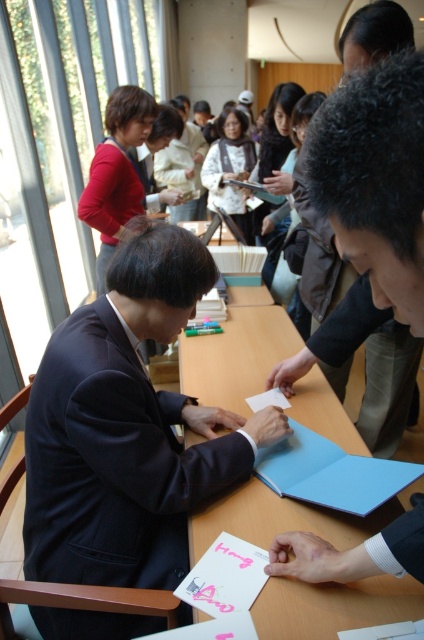
Question: Is matte black folder at center smaller than white paper at center?

Choices:
 (A) no
 (B) yes

Answer: (A)

Question: Which point is farther to the camera?

Choices:
 (A) (415, 596)
 (B) (41, 524)
 (C) (219, 547)

Answer: (B)

Question: Is dark blue fabric business suit at center to the right of white paper at center from the viewer's perspective?

Choices:
 (A) no
 (B) yes

Answer: (A)

Question: Which point is closer to the camera?

Choices:
 (A) matte red sweater at upper left
 (B) pink matte card at lower center

Answer: (B)

Question: Does matte black folder at center appear under matte red sweater at upper left?

Choices:
 (A) no
 (B) yes

Answer: (B)

Question: Which object is farther from the camera taking this photo?

Choices:
 (A) white paper at center
 (B) matte red sweater at upper left
 (C) pink matte card at lower center

Answer: (B)